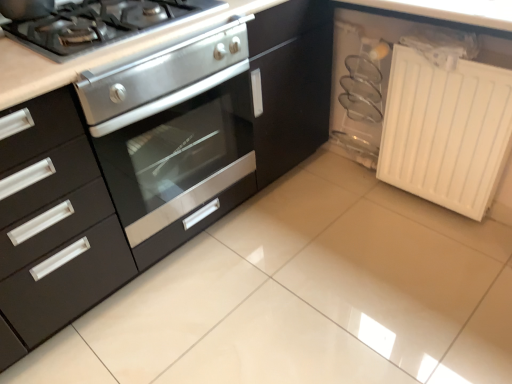
Question: In terms of width, does white matte radiator at lower right look wider or thinner when compared to stainless steel gas stove at upper left?

Choices:
 (A) thin
 (B) wide

Answer: (A)

Question: Is white matte radiator at lower right in front of or behind stainless steel gas stove at upper left in the image?

Choices:
 (A) behind
 (B) front

Answer: (A)

Question: Estimate the real-world distances between objects in this image. Which object is closer to the stainless steel oven at center?

Choices:
 (A) stainless steel gas stove at upper left
 (B) white matte radiator at lower right

Answer: (A)

Question: Estimate the real-world distances between objects in this image. Which object is closer to the stainless steel gas stove at upper left?

Choices:
 (A) stainless steel oven at center
 (B) white matte radiator at lower right

Answer: (A)